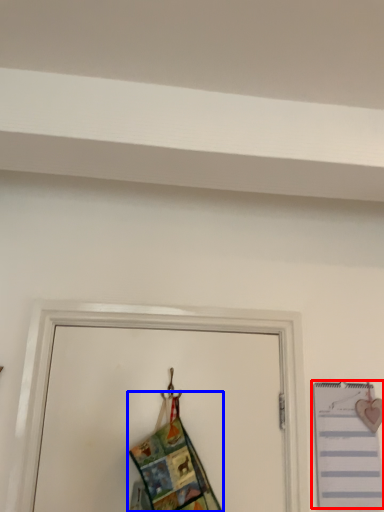
Question: Which point is closer to the camera, notebook (highlighted by a red box) or fancy dress (highlighted by a blue box)?

Choices:
 (A) notebook
 (B) fancy dress

Answer: (B)